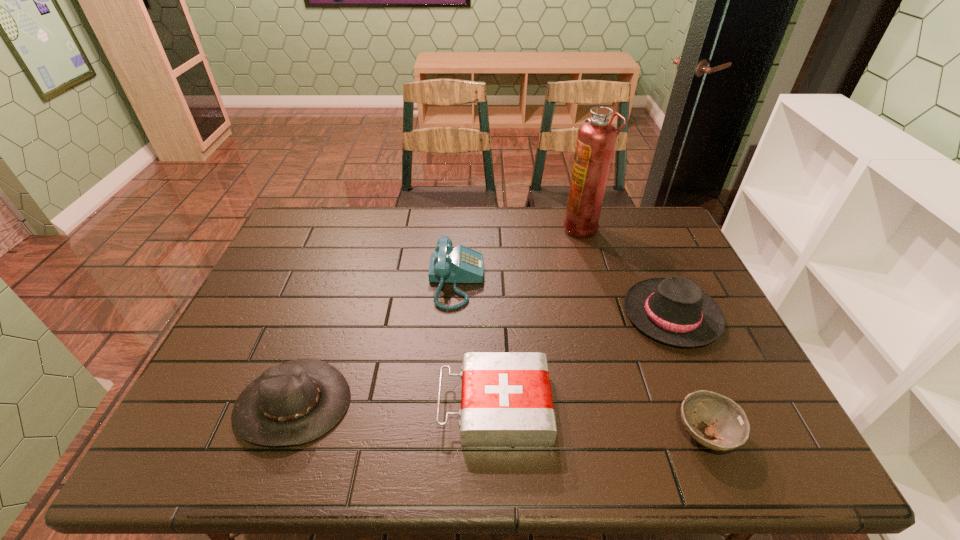
Point out which object is positioned as the third nearest to the leftmost object. Please provide its 2D coordinates. Your answer should be formatted as a tuple, i.e. [(x, y)], where the tuple contains the x and y coordinates of a point satisfying the conditions above.

[(674, 310)]

This screenshot has width=960, height=540. In order to click on vacant space that satisfies the following two spatial constraints: 1. on the front-facing side of the bowl; 2. on the left side of the hat in this screenshot , I will do `click(282, 434)`.

Locate an element on the screen. Image resolution: width=960 pixels, height=540 pixels. vacant space that satisfies the following two spatial constraints: 1. on the dial of the telephone; 2. on the front-facing side of the hat is located at coordinates (449, 404).

Where is `vacant space that satisfies the following two spatial constraints: 1. on the back side of the bowl; 2. on the side of the farthest object with the label`? This screenshot has height=540, width=960. vacant space that satisfies the following two spatial constraints: 1. on the back side of the bowl; 2. on the side of the farthest object with the label is located at coordinates (622, 227).

Find the location of a particular element. The width and height of the screenshot is (960, 540). vacant region that satisfies the following two spatial constraints: 1. on the back side of the bowl; 2. on the front side of the first-aid kit is located at coordinates (694, 406).